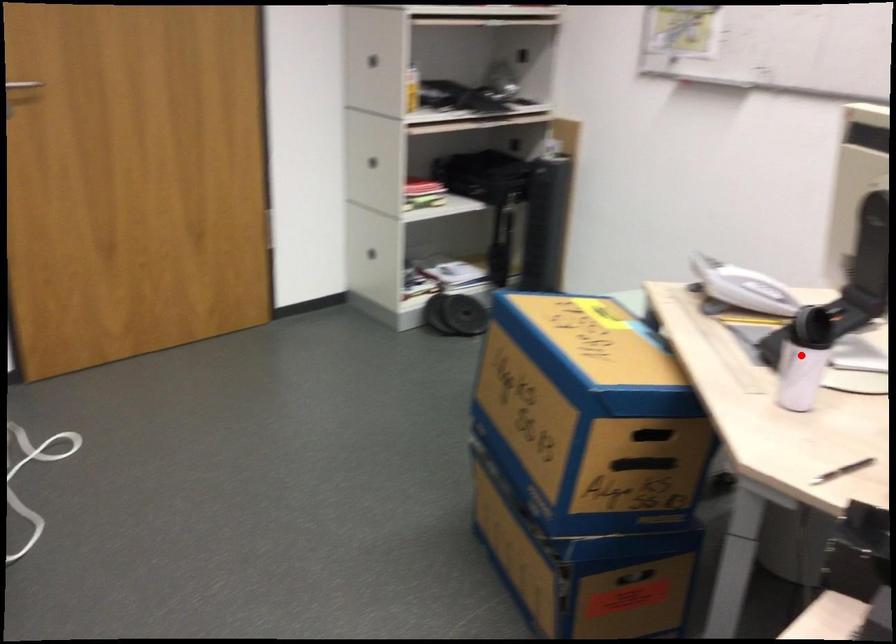
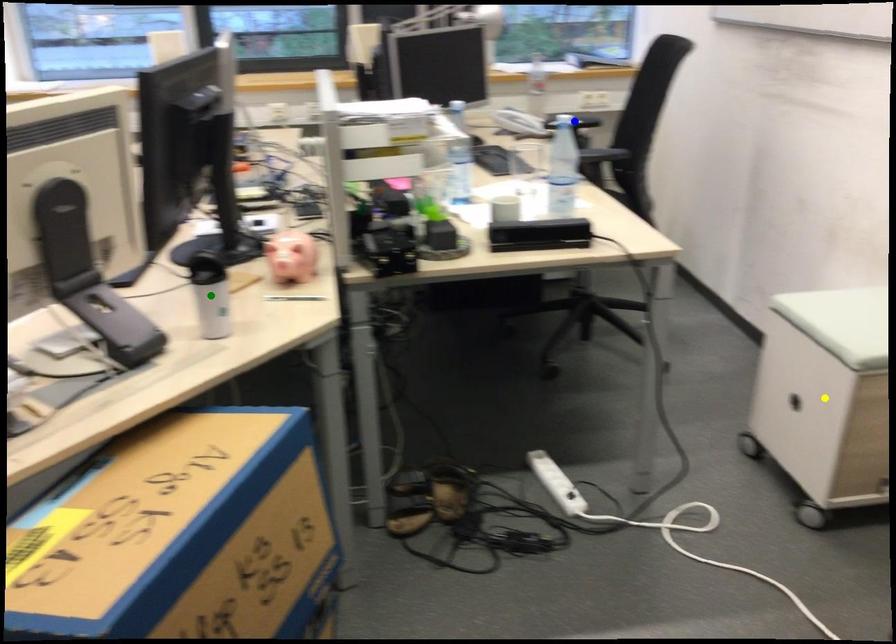
Question: I am providing you with two images of the same scene from different viewpoints. A red point is marked on the first image. You are given multiple points on the second image. Which point in image 2 represents the same 3d spot as the red point in image 1?

Choices:
 (A) blue point
 (B) yellow point
 (C) green point

Answer: (C)